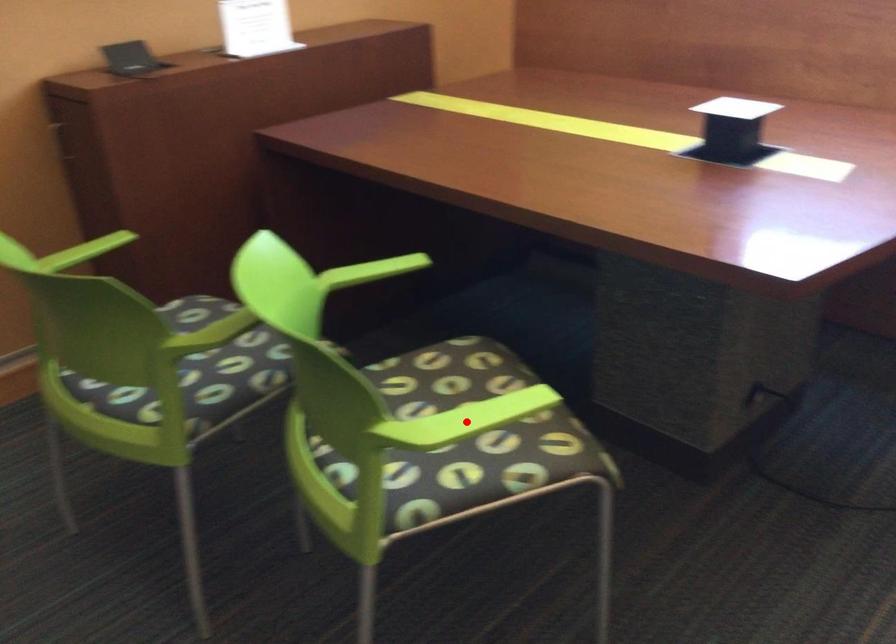
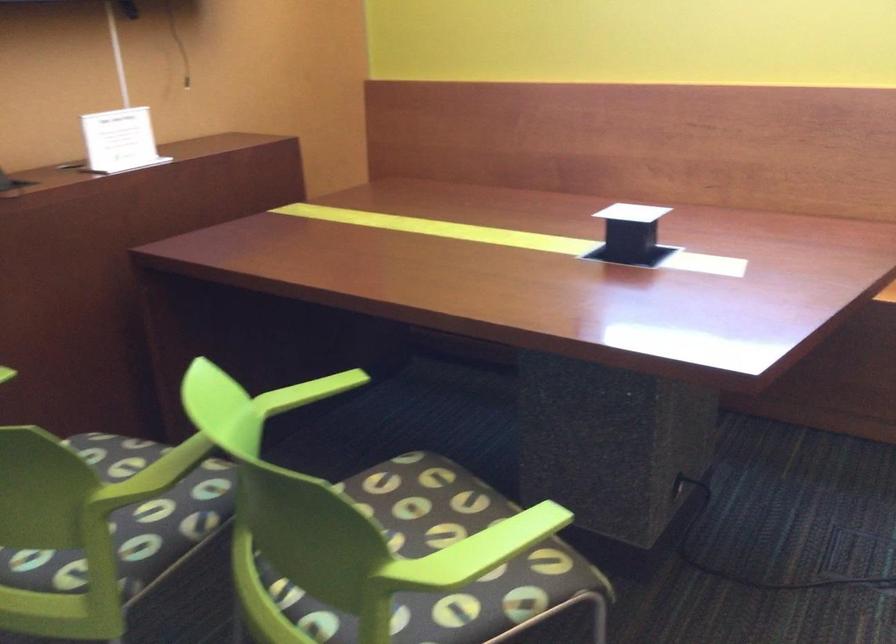
Find the pixel in the second image that matches the highlighted location in the first image.

(476, 552)